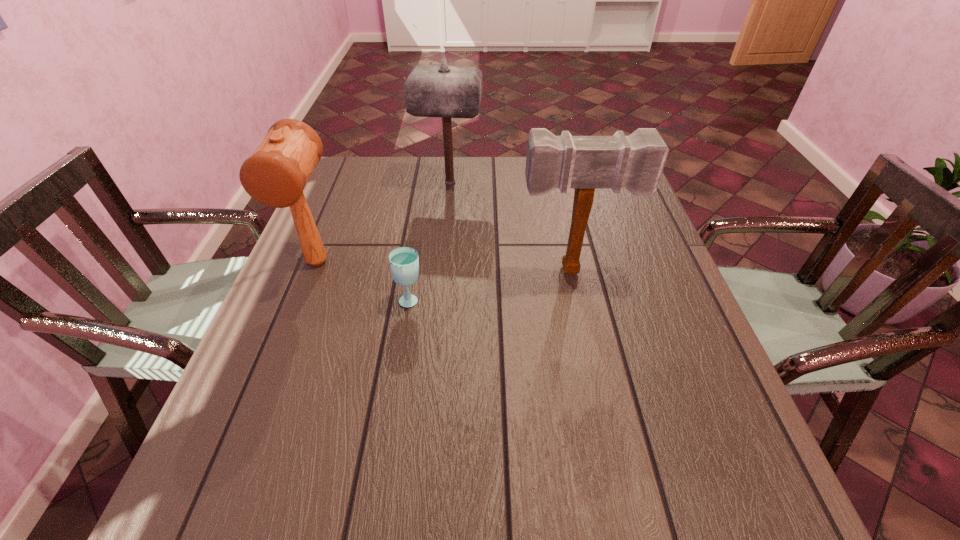
At what (x,y) coordinates should I click in order to perform the action: click on object at the far edge. Please return your answer as a coordinate pair (x, y). Looking at the image, I should click on (444, 91).

Image resolution: width=960 pixels, height=540 pixels. What are the coordinates of `object located at the left edge` in the screenshot? It's located at (275, 175).

This screenshot has height=540, width=960. Identify the location of object that is at the right edge. pos(635,162).

The height and width of the screenshot is (540, 960). In the image, there is a desktop. Identify the location of free region at the far edge. (415, 161).

Where is `vacant position at the near edge of the desktop`? vacant position at the near edge of the desktop is located at coordinates (353, 478).

This screenshot has height=540, width=960. In the image, there is a desktop. In order to click on free region at the left edge in this screenshot , I will do `click(279, 349)`.

I want to click on vacant area at the right edge, so click(x=714, y=375).

In the image, there is a desktop. Identify the location of vacant space at the far left corner. (343, 184).

In the image, there is a desktop. Where is `vacant space at the far right corner`? vacant space at the far right corner is located at coordinates click(602, 189).

Find the location of a particular element. The height and width of the screenshot is (540, 960). free space between the rightmost object and the second mallet from left to right is located at coordinates (512, 226).